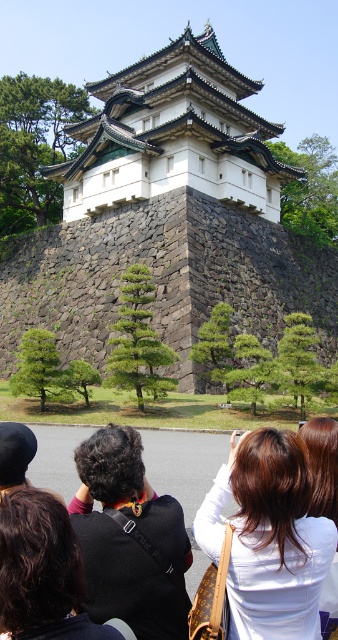
Question: Is stone/brick palace at center above black fabric backpack at center?

Choices:
 (A) yes
 (B) no

Answer: (A)

Question: Does white stone building at center have a greater width compared to black fabric at lower left?

Choices:
 (A) no
 (B) yes

Answer: (B)

Question: Considering the relative positions of white stone building at center and white matte shirt at center in the image provided, where is white stone building at center located with respect to white matte shirt at center?

Choices:
 (A) above
 (B) below

Answer: (A)

Question: Which of the following is the farthest from the observer?

Choices:
 (A) (142, 93)
 (B) (64, 276)

Answer: (A)

Question: Which point is closer to the camera?

Choices:
 (A) (291, 632)
 (B) (136, 125)
 (C) (100, 141)

Answer: (A)

Question: Among these points, which one is farthest from the camera?

Choices:
 (A) (231, 77)
 (B) (309, 436)
 (C) (74, 456)
 (D) (169, 250)

Answer: (A)